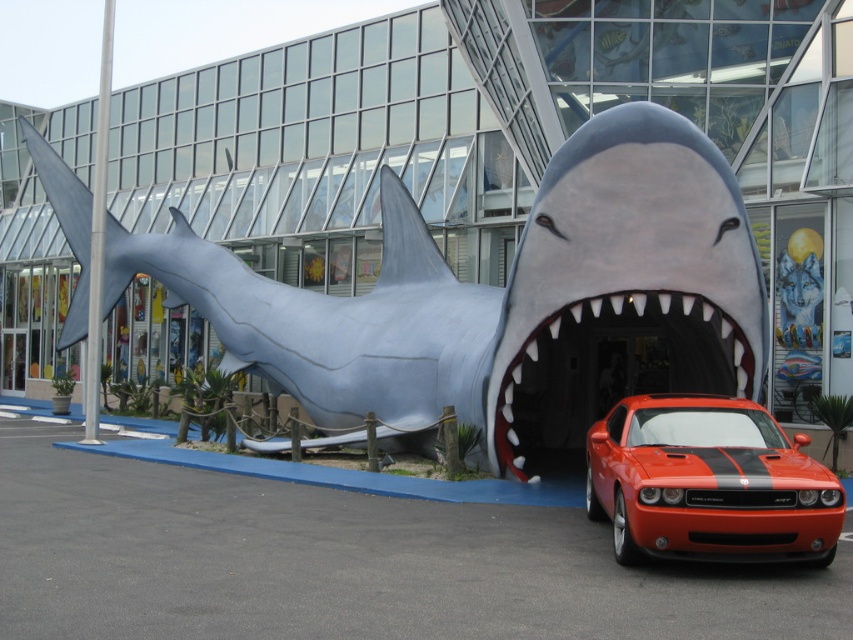
Question: Which of these objects is positioned closest to the gray matte shark at center?

Choices:
 (A) orange glossy car at center
 (B) white teeth plastic mouth at center

Answer: (A)

Question: Which is nearer to the gray matte shark at center?

Choices:
 (A) white teeth plastic mouth at center
 (B) orange glossy car at center

Answer: (B)

Question: Does gray matte shark at center appear on the left side of white teeth plastic mouth at center?

Choices:
 (A) no
 (B) yes

Answer: (B)

Question: Is orange glossy car at center bigger than white teeth plastic mouth at center?

Choices:
 (A) yes
 (B) no

Answer: (A)

Question: Is gray matte shark at center above orange glossy car at center?

Choices:
 (A) yes
 (B) no

Answer: (A)

Question: Which object is positioned closest to the orange glossy car at center?

Choices:
 (A) gray matte shark at center
 (B) white teeth plastic mouth at center

Answer: (A)